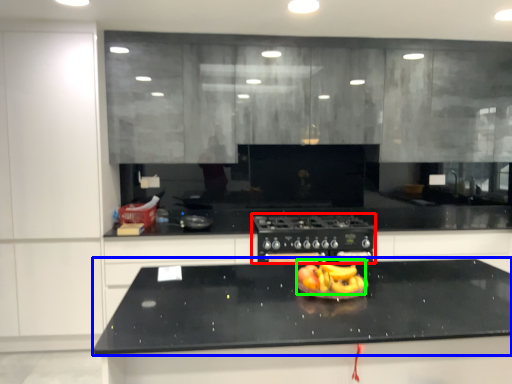
Question: Which object is the farthest from home appliance (highlighted by a red box)? Choose among these: countertop (highlighted by a blue box) or fruit dish (highlighted by a green box).

Choices:
 (A) countertop
 (B) fruit dish

Answer: (B)